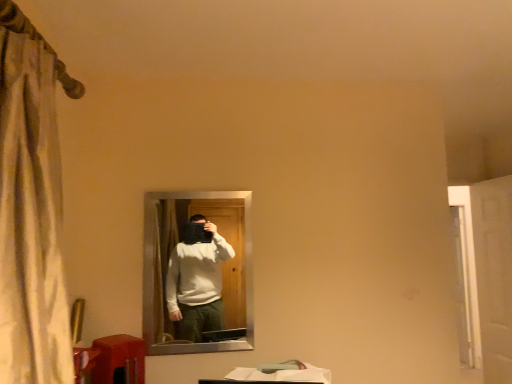
Question: Is white glossy door at right oriented towards matte black mirror at center?

Choices:
 (A) no
 (B) yes

Answer: (A)

Question: Can you confirm if white glossy door at right is wider than matte black mirror at center?

Choices:
 (A) yes
 (B) no

Answer: (A)

Question: Does white glossy door at right appear on the left side of matte black mirror at center?

Choices:
 (A) no
 (B) yes

Answer: (A)

Question: Is white glossy door at right further to the viewer compared to matte black mirror at center?

Choices:
 (A) yes
 (B) no

Answer: (A)

Question: Is the surface of white glossy door at right in direct contact with matte black mirror at center?

Choices:
 (A) yes
 (B) no

Answer: (B)

Question: Would you say matte orange table at lower left is to the left or to the right of matte black mirror at center in the picture?

Choices:
 (A) right
 (B) left

Answer: (B)

Question: From the image's perspective, is matte orange table at lower left located above or below matte black mirror at center?

Choices:
 (A) above
 (B) below

Answer: (B)

Question: From a real-world perspective, is matte orange table at lower left positioned above or below matte black mirror at center?

Choices:
 (A) above
 (B) below

Answer: (B)

Question: Considering the positions of matte orange table at lower left and matte black mirror at center in the image, is matte orange table at lower left bigger or smaller than matte black mirror at center?

Choices:
 (A) big
 (B) small

Answer: (B)

Question: In the image, is matte orange table at lower left on the left side or the right side of white glossy door at right?

Choices:
 (A) right
 (B) left

Answer: (B)

Question: Is matte orange table at lower left bigger or smaller than white glossy door at right?

Choices:
 (A) big
 (B) small

Answer: (B)

Question: Is matte orange table at lower left taller or shorter than white glossy door at right?

Choices:
 (A) tall
 (B) short

Answer: (B)

Question: Which is correct: matte orange table at lower left is inside white glossy door at right, or outside of it?

Choices:
 (A) inside
 (B) outside

Answer: (B)

Question: Is matte black mirror at center wider or thinner than matte orange table at lower left?

Choices:
 (A) thin
 (B) wide

Answer: (A)

Question: Considering the positions of matte black mirror at center and matte orange table at lower left in the image, is matte black mirror at center taller or shorter than matte orange table at lower left?

Choices:
 (A) short
 (B) tall

Answer: (B)